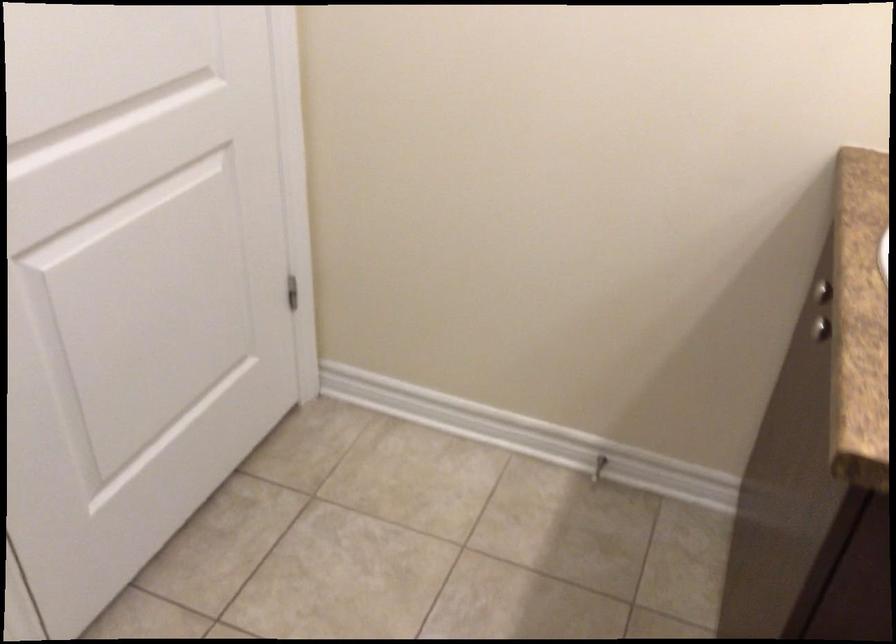
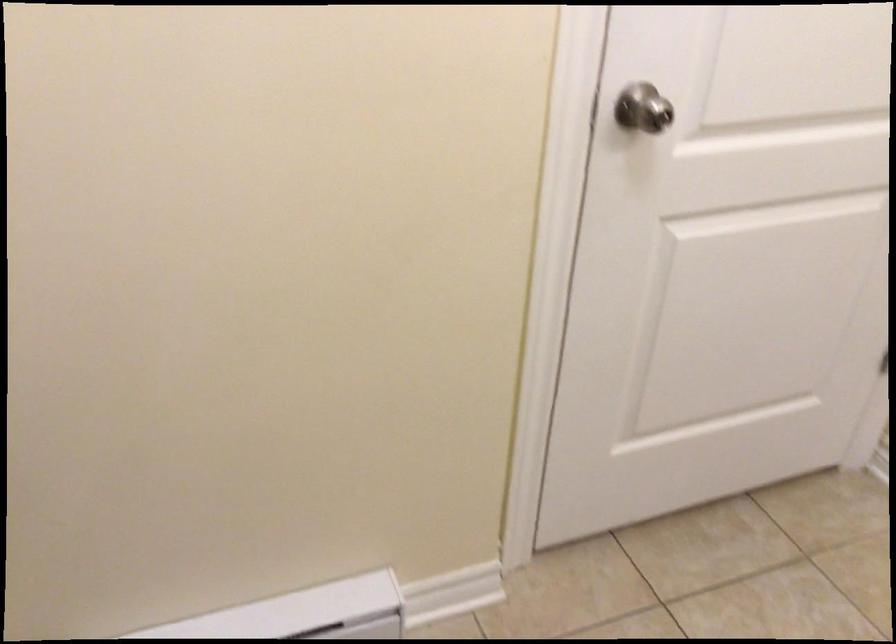
Question: How did the camera likely rotate?

Choices:
 (A) Left
 (B) Right
 (C) Up
 (D) Down

Answer: (A)